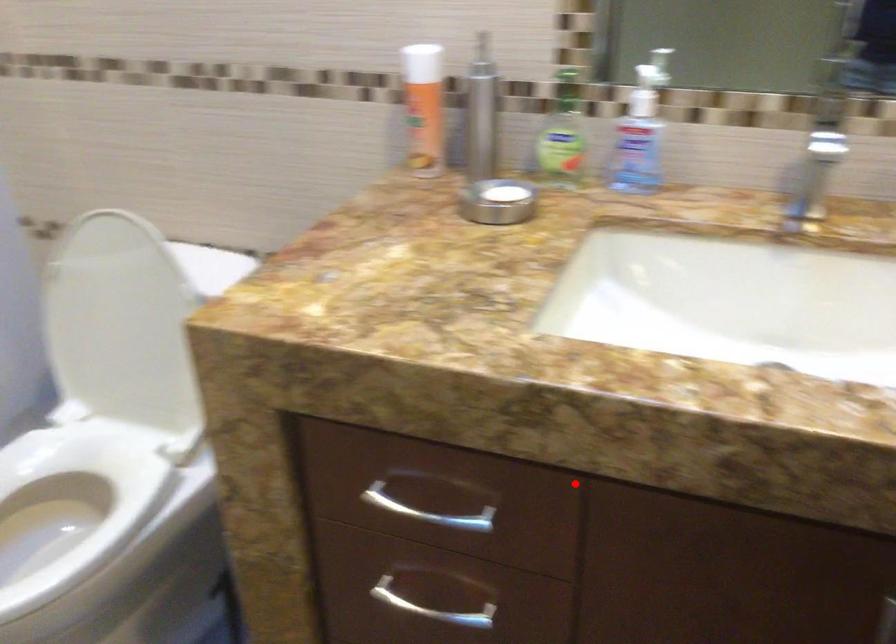
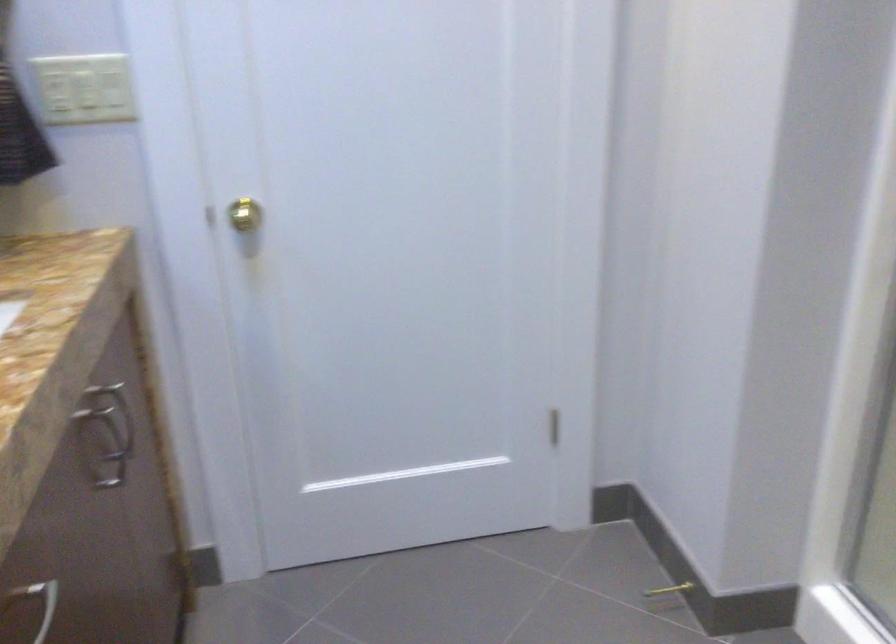
Question: I am providing you with two images of the same scene from different viewpoints. In image1, a red point is highlighted. Considering the same 3D point in image2, which of the following is correct?

Choices:
 (A) It is closer
 (B) It is farther

Answer: (B)